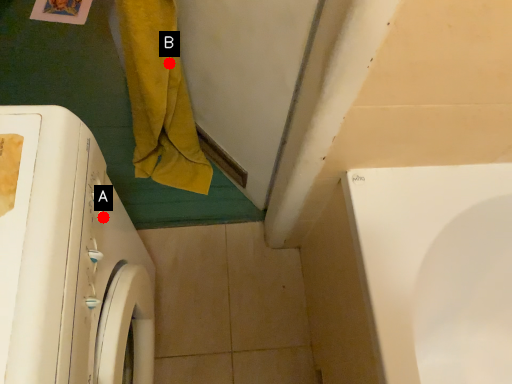
Question: Two points are circled on the image, labeled by A and B beside each circle. Which point is further to the camera?

Choices:
 (A) A is further
 (B) B is further

Answer: (B)